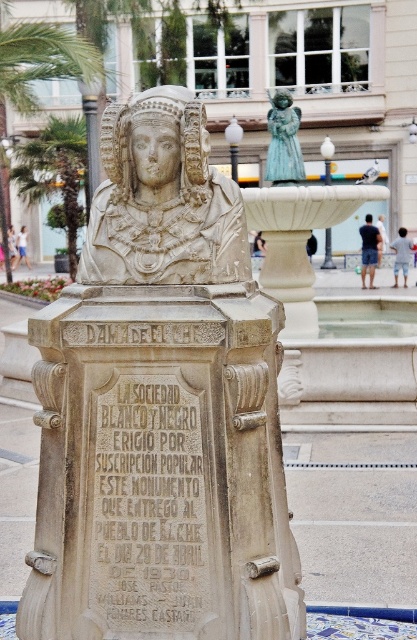
Based on the coordinates provided in the description, where is the beige stone bust at center located in the image?

The beige stone bust at center is located at point (160,410) in the image.